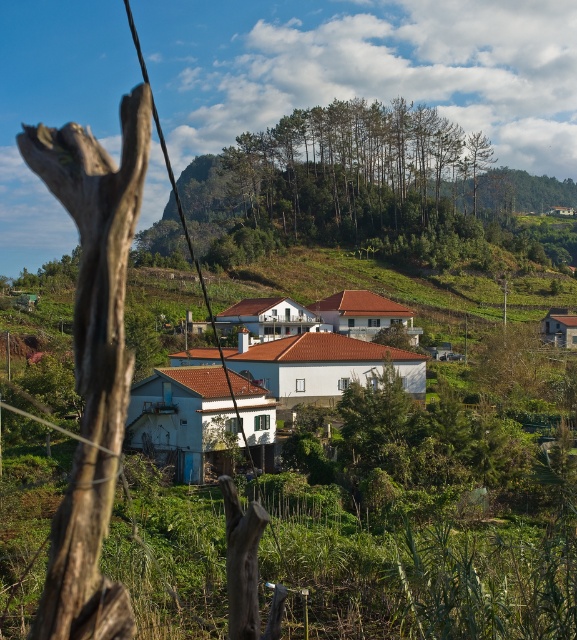
You are a photographer aiming to capture the white matte house at center and the green leafy trees at upper center in a single frame. Based on their heights, which object will appear taller in the photo?

The green leafy trees at upper center will appear taller in the photo since they have a greater height compared to the white matte house at center according to the description.

You are a drone operator planning to fly a drone from the green leafy trees at upper center to the white matte house at center. According to the scene description, what is the approximate distance you need to cover?

The green leafy trees at upper center and white matte house at center are 81.74 meters apart, so the approximate distance to cover is 81.74 meters.